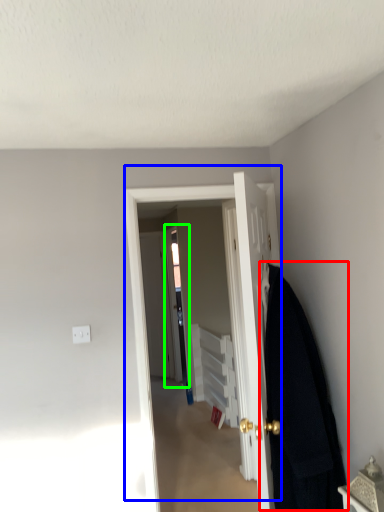
Question: Which object is the farthest from blanket (highlighted by a red box)? Choose among these: door (highlighted by a blue box) or screen door (highlighted by a green box).

Choices:
 (A) door
 (B) screen door

Answer: (B)